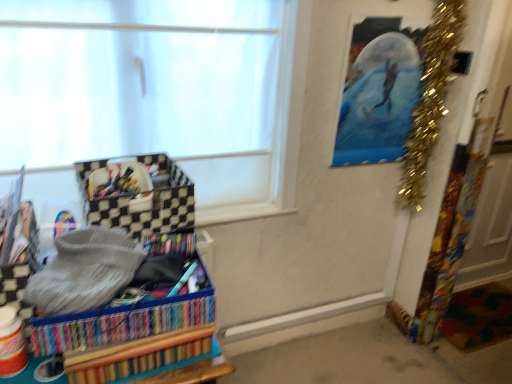
Question: Relative to white matte window at upper left, is gold tinsel garland at upper right in front or behind?

Choices:
 (A) front
 (B) behind

Answer: (B)

Question: From a real-world perspective, relative to white matte window at upper left, is gold tinsel garland at upper right vertically above or below?

Choices:
 (A) below
 (B) above

Answer: (B)

Question: Which is farther from the gold tinsel garland at upper right?

Choices:
 (A) metallic blue painting at upper right
 (B) black checkered storage box at left, the second storage box when ordered from bottom to top
 (C) multicolored woven basket at lower left, placed as the second storage box when sorted from top to bottom
 (D) white matte window at upper left

Answer: (C)

Question: Which of these objects is positioned farthest from the black checkered storage box at left, the second storage box when ordered from bottom to top?

Choices:
 (A) multicolored woven basket at lower left, acting as the 1th storage box starting from the bottom
 (B) gold tinsel garland at upper right
 (C) metallic blue painting at upper right
 (D) white matte window at upper left

Answer: (B)